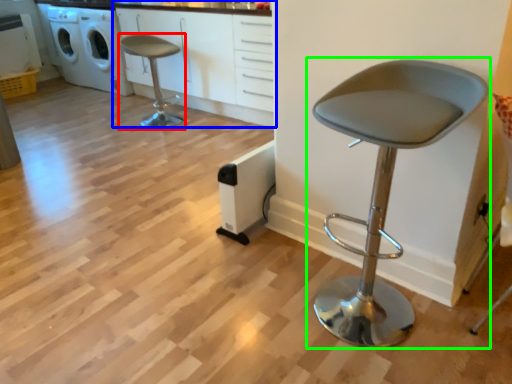
Question: Which is farther away from chair (highlighted by a red box)? cabinetry (highlighted by a blue box) or chair (highlighted by a green box)?

Choices:
 (A) cabinetry
 (B) chair

Answer: (B)